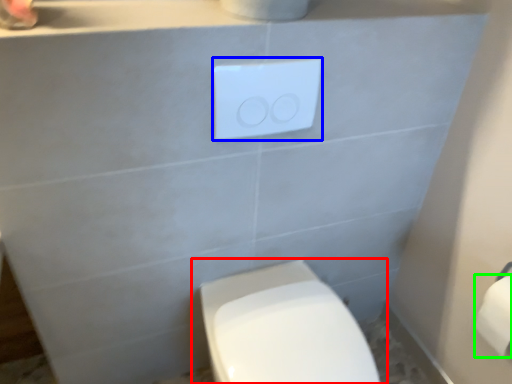
Question: Considering the real-world distances, which object is closest to toilet (highlighted by a red box)? light switch (highlighted by a blue box) or toilet paper (highlighted by a green box).

Choices:
 (A) light switch
 (B) toilet paper

Answer: (B)